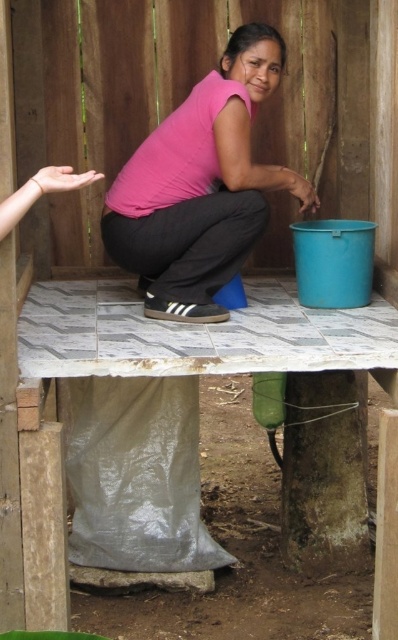
You are a painter who needs to place a 1 meter wide canvas between the white tiled picnic table at center and the pink matte shirt at center. Can you fit it there?

The white tiled picnic table at center might be wider than the pink matte shirt at center, so the space between them may be sufficient to fit a 1 meter wide canvas. However, since the exact width difference isn not specified, it is uncertain. Please measure the actual distance before placing the canvas.